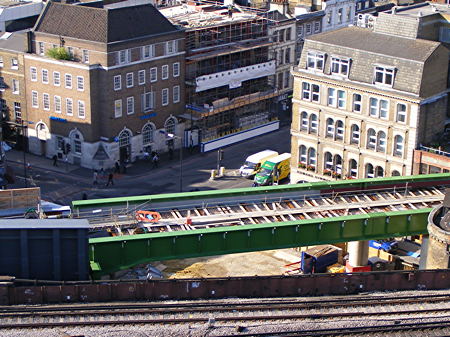
You are a GUI agent. You are given a task and a screenshot of the screen. Output one action in this format:
    pyautogui.click(x=<x>, y=<y>)
    Task: Click on the column/pillar
    The width and height of the screenshot is (450, 337).
    Given the screenshot: What is the action you would take?
    pyautogui.click(x=359, y=252)